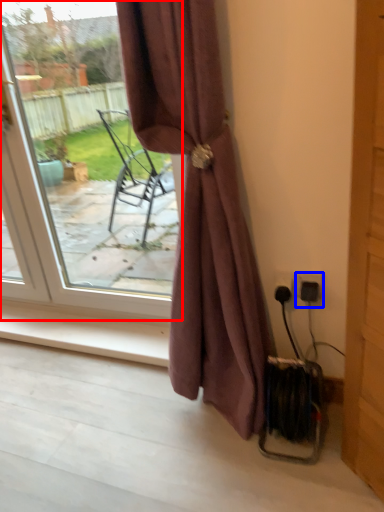
Question: Which object appears farthest to the camera in this image, door (highlighted by a red box) or electric outlet (highlighted by a blue box)?

Choices:
 (A) door
 (B) electric outlet

Answer: (B)